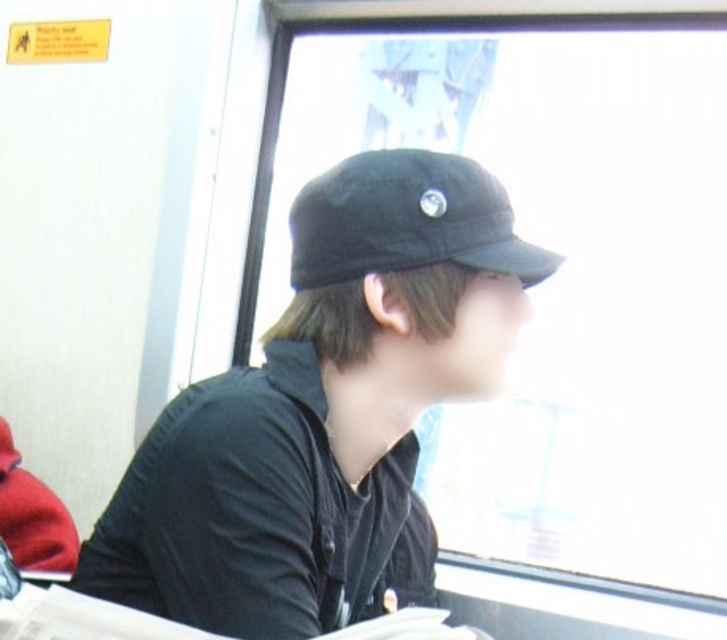
You are a delivery robot with a height of 30 inches. You are placed inside the public transportation vehicle shown. The transparent glass window at center is in front of you, and the black matte baseball cap at upper center is above your head. Can you pass through the space between them without bending?

The distance between the transparent glass window at center and the black matte baseball cap at upper center is 29.99 inches, which is slightly less than your height of 30 inches. Therefore, you would need to bend or lower yourself to pass through the space between them.

You are inside a public transportation vehicle and want to look outside through the transparent glass window at center. Based on the coordinates provided, can you confirm if the window is positioned in the central area of the vehicle?

The transparent glass window at center is located at coordinates point (550, 288), which places it in the central area of the vehicle.

You are inside a public transportation vehicle and want to know which of the two points, point (425, 131) or point (457, 173), is closer to you. Which one is it?

Point (425, 131) is further to the viewer than point (457, 173), so the closer point is point (457, 173).